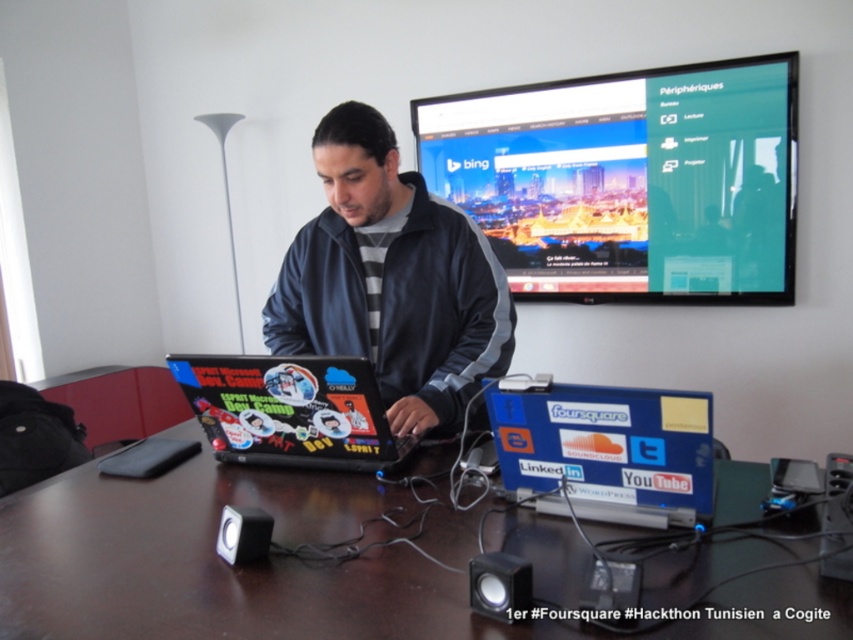
Question: Can you confirm if matte black laptop at center is positioned to the right of sticker-covered laptop at center?

Choices:
 (A) no
 (B) yes

Answer: (B)

Question: Which is farther from the sticker-covered laptop at center?

Choices:
 (A) matte black laptop at center
 (B) brown wooden table at center

Answer: (A)

Question: Does matte black laptop at center appear over sticker-covered laptop at center?

Choices:
 (A) yes
 (B) no

Answer: (A)

Question: Does brown wooden table at center have a lesser width compared to blue plastic laptop at center?

Choices:
 (A) yes
 (B) no

Answer: (B)

Question: Which point is farther to the camera?

Choices:
 (A) (103, 502)
 (B) (318, 321)

Answer: (B)

Question: Estimate the real-world distances between objects in this image. Which object is closer to the blue plastic laptop at center?

Choices:
 (A) brown wooden table at center
 (B) matte black laptop at center
 (C) sticker-covered laptop at center

Answer: (A)